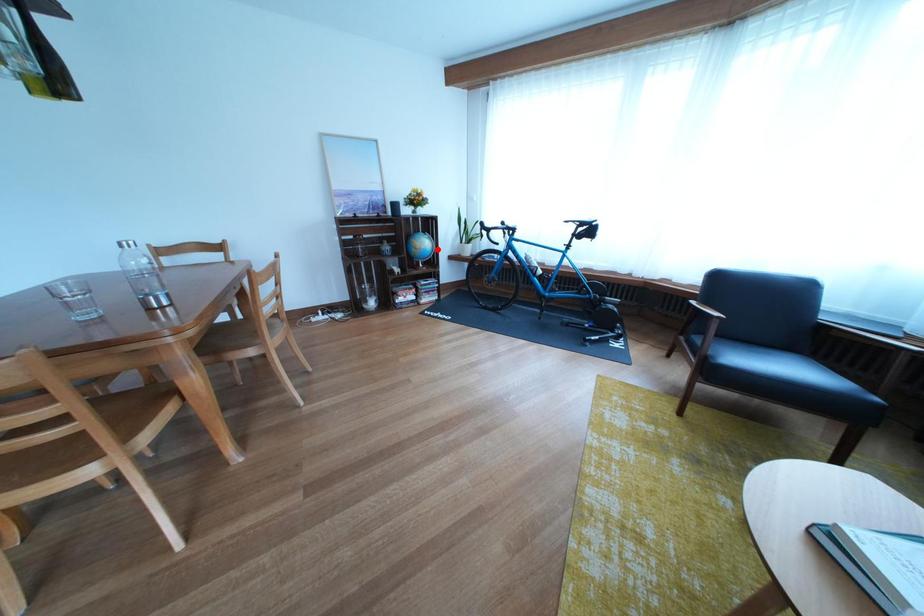
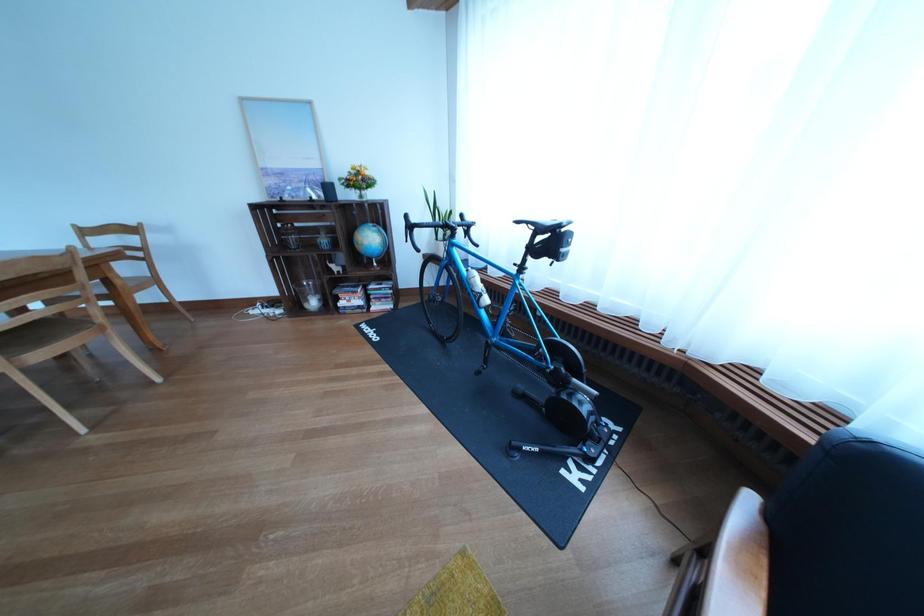
In the second image, find the point that corresponds to the highlighted location in the first image.

(383, 244)